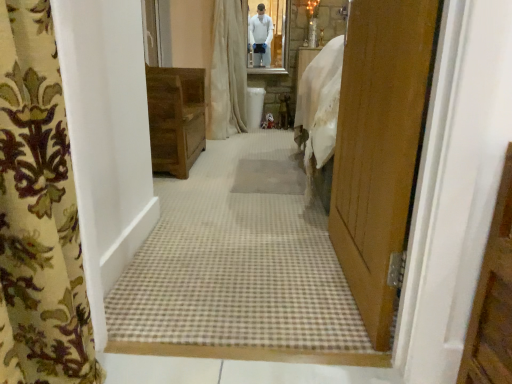
Question: From the image's perspective, is wooden cabinet at center located above wooden door at right?

Choices:
 (A) yes
 (B) no

Answer: (A)

Question: From a real-world perspective, is wooden cabinet at center over wooden door at right?

Choices:
 (A) no
 (B) yes

Answer: (A)

Question: Would you say wooden cabinet at center is outside wooden door at right?

Choices:
 (A) no
 (B) yes

Answer: (B)

Question: Is wooden cabinet at center looking in the opposite direction of wooden door at right?

Choices:
 (A) yes
 (B) no

Answer: (B)

Question: Is wooden door at right inside wooden cabinet at center?

Choices:
 (A) no
 (B) yes

Answer: (A)

Question: Is wooden cabinet at center inside the boundaries of beige fabric curtain at center, which ranks as the first curtain in top-to-bottom order, or outside?

Choices:
 (A) outside
 (B) inside

Answer: (A)

Question: From a real-world perspective, is wooden cabinet at center above or below beige fabric curtain at center, marked as the 1th curtain in a back-to-front arrangement?

Choices:
 (A) below
 (B) above

Answer: (A)

Question: Considering the positions of wooden cabinet at center and beige fabric curtain at center, which appears as the second curtain when viewed from the front, in the image, is wooden cabinet at center bigger or smaller than beige fabric curtain at center, which appears as the second curtain when viewed from the front,?

Choices:
 (A) small
 (B) big

Answer: (A)

Question: From the image's perspective, is wooden cabinet at center located above or below beige fabric curtain at center, marked as the 1th curtain in a back-to-front arrangement?

Choices:
 (A) below
 (B) above

Answer: (A)

Question: Is wooden door at right spatially inside floral fabric curtain at left, the 2th curtain positioned from the back, or outside of it?

Choices:
 (A) outside
 (B) inside

Answer: (A)

Question: In the image, is wooden door at right on the left side or the right side of floral fabric curtain at left, arranged as the first curtain when viewed from the front?

Choices:
 (A) right
 (B) left

Answer: (A)

Question: Is wooden door at right bigger or smaller than floral fabric curtain at left, marked as the first curtain in a bottom-to-top arrangement?

Choices:
 (A) small
 (B) big

Answer: (B)

Question: Looking at their shapes, would you say wooden door at right is wider or thinner than floral fabric curtain at left, the second curtain viewed from the top?

Choices:
 (A) thin
 (B) wide

Answer: (A)

Question: Does point (10, 105) appear closer or farther from the camera than point (159, 86)?

Choices:
 (A) farther
 (B) closer

Answer: (B)

Question: Is floral fabric curtain at left, the 2th curtain positioned from the back, bigger or smaller than wooden cabinet at center?

Choices:
 (A) big
 (B) small

Answer: (B)